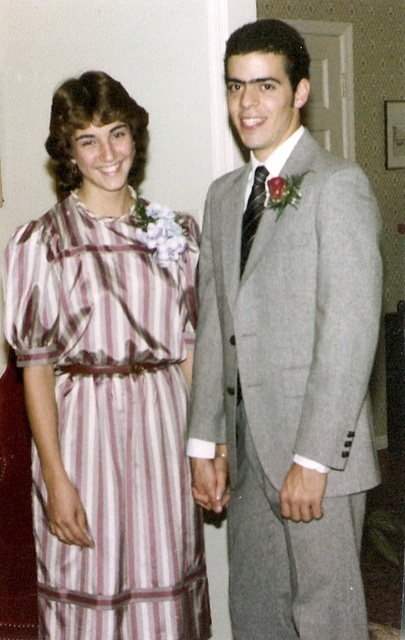
Question: Is gray wool suit at center positioned before striped silk dress at left?

Choices:
 (A) no
 (B) yes

Answer: (B)

Question: Does gray wool suit at center have a lesser width compared to striped silk dress at left?

Choices:
 (A) yes
 (B) no

Answer: (A)

Question: Is gray wool suit at center wider than striped silk dress at left?

Choices:
 (A) yes
 (B) no

Answer: (B)

Question: Which object appears farthest from the camera in this image?

Choices:
 (A) gray wool suit at center
 (B) striped silk dress at left

Answer: (B)